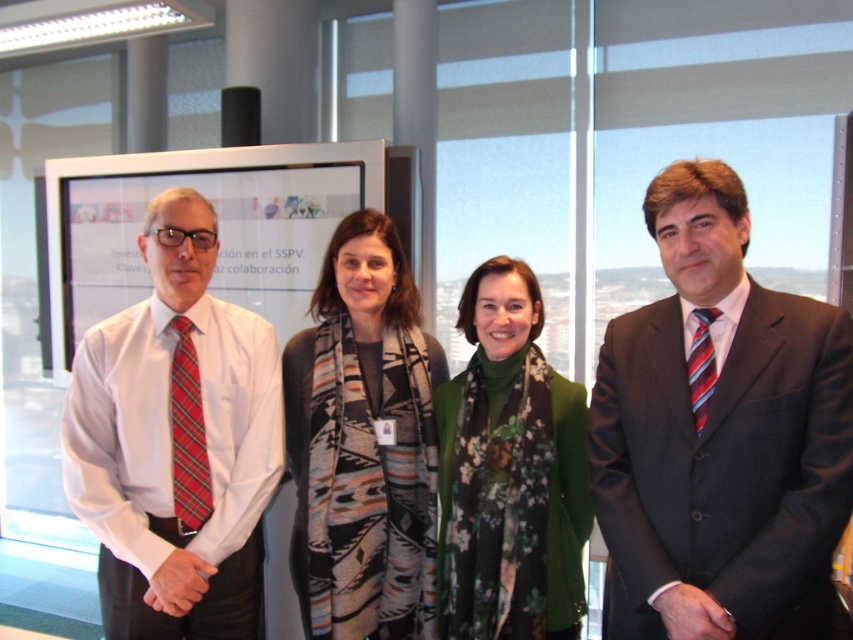
You are attending a professional event and need to locate the dark gray suit at center. Where should you look in relation to the matte white poster at center?

The dark gray suit at center is positioned under the matte white poster at center, so look below the poster to find it.

You are standing in the office and want to move from the point at coordinates point (459, 600) to the point at coordinates point (427, 458). Which direction should you move to get closer to your destination?

Since point (459, 600) is in front of point (427, 458), you should move backward to reach point (427, 458).

You are standing in the office and need to place a small potted plant between the two points labeled point (664, 257) and point (88, 272). Which point should the plant be closer to?

The plant should be closer to point (664, 257) because it is in front of point (88, 272).